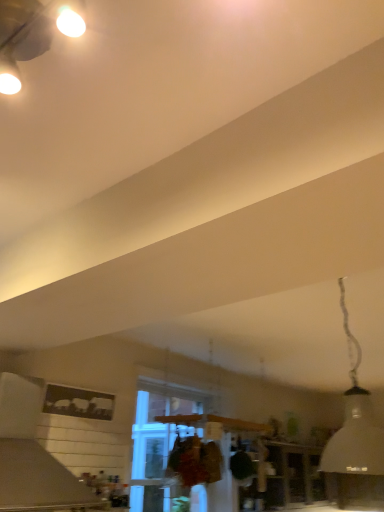
Question: Does clear glass window at center come in front of white matte vent at upper left?

Choices:
 (A) yes
 (B) no

Answer: (B)

Question: Is the surface of clear glass window at center in direct contact with white matte vent at upper left?

Choices:
 (A) no
 (B) yes

Answer: (A)

Question: From the image's perspective, is clear glass window at center on white matte vent at upper left?

Choices:
 (A) no
 (B) yes

Answer: (A)

Question: Are clear glass window at center and white matte vent at upper left far apart?

Choices:
 (A) no
 (B) yes

Answer: (B)

Question: From the image's perspective, does clear glass window at center appear lower than white matte vent at upper left?

Choices:
 (A) yes
 (B) no

Answer: (A)

Question: From a real-world perspective, is clear glass window at center located higher than white matte vent at upper left?

Choices:
 (A) yes
 (B) no

Answer: (A)

Question: From a real-world perspective, is white matte lampshade at upper right below white matte vent at upper left?

Choices:
 (A) yes
 (B) no

Answer: (B)

Question: Would you say white matte lampshade at upper right contains white matte vent at upper left?

Choices:
 (A) yes
 (B) no

Answer: (B)

Question: Does white matte lampshade at upper right have a greater width compared to white matte vent at upper left?

Choices:
 (A) no
 (B) yes

Answer: (A)

Question: Considering the relative sizes of white matte lampshade at upper right and white matte vent at upper left in the image provided, is white matte lampshade at upper right taller than white matte vent at upper left?

Choices:
 (A) no
 (B) yes

Answer: (B)

Question: Can you confirm if white matte lampshade at upper right is shorter than white matte vent at upper left?

Choices:
 (A) yes
 (B) no

Answer: (B)

Question: Is white matte lampshade at upper right positioned with its back to white matte vent at upper left?

Choices:
 (A) no
 (B) yes

Answer: (A)

Question: Considering the relative sizes of white matte vent at upper left and white matte lampshade at upper right in the image provided, is white matte vent at upper left thinner than white matte lampshade at upper right?

Choices:
 (A) no
 (B) yes

Answer: (A)